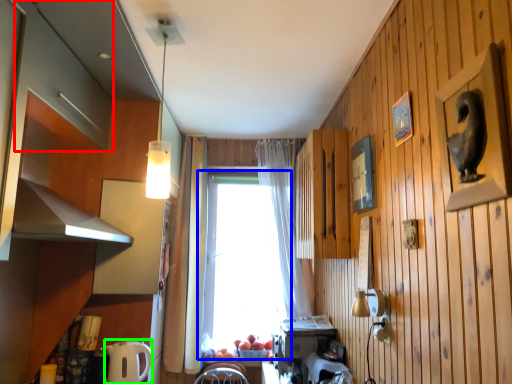
Question: Which object is positioned farthest from cabinetry (highlighted by a red box)? Select from window (highlighted by a blue box) and appliance (highlighted by a green box).

Choices:
 (A) window
 (B) appliance

Answer: (A)